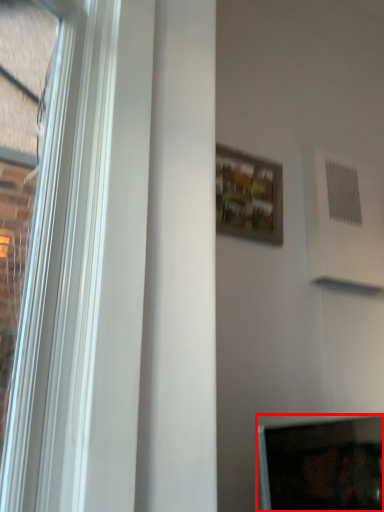
Question: Considering the relative positions of computer screen (annotated by the red box) and picture frame in the image provided, where is computer screen (annotated by the red box) located with respect to the staircase?

Choices:
 (A) left
 (B) right

Answer: (B)